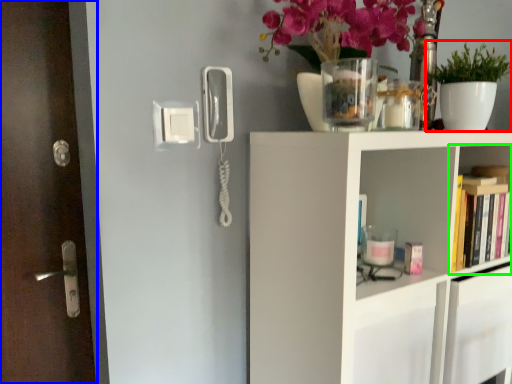
Question: Which object is positioned closest to houseplant (highlighted by a red box)? Select from door (highlighted by a blue box) and shelf (highlighted by a green box).

Choices:
 (A) door
 (B) shelf

Answer: (B)